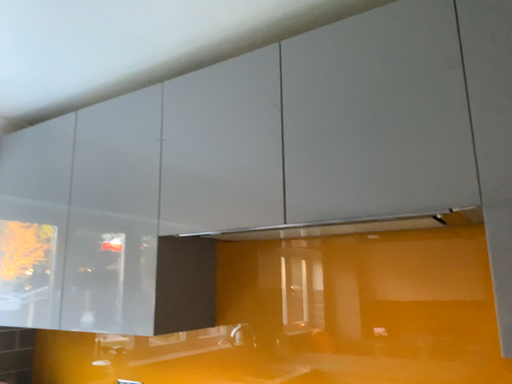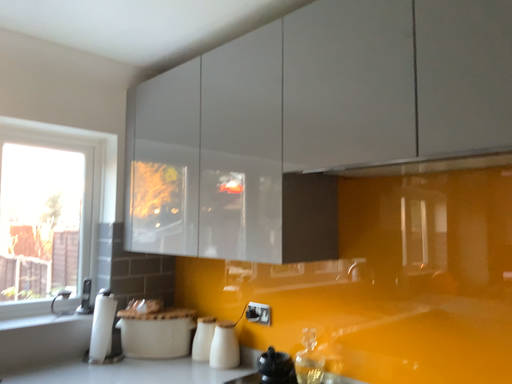
Question: How did the camera likely rotate when shooting the video?

Choices:
 (A) rotated left
 (B) rotated right

Answer: (A)